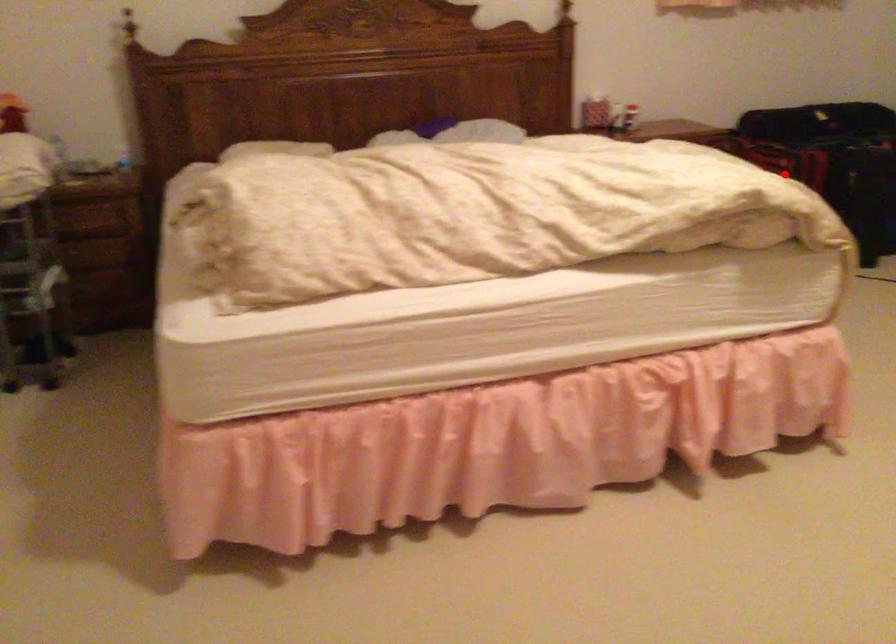
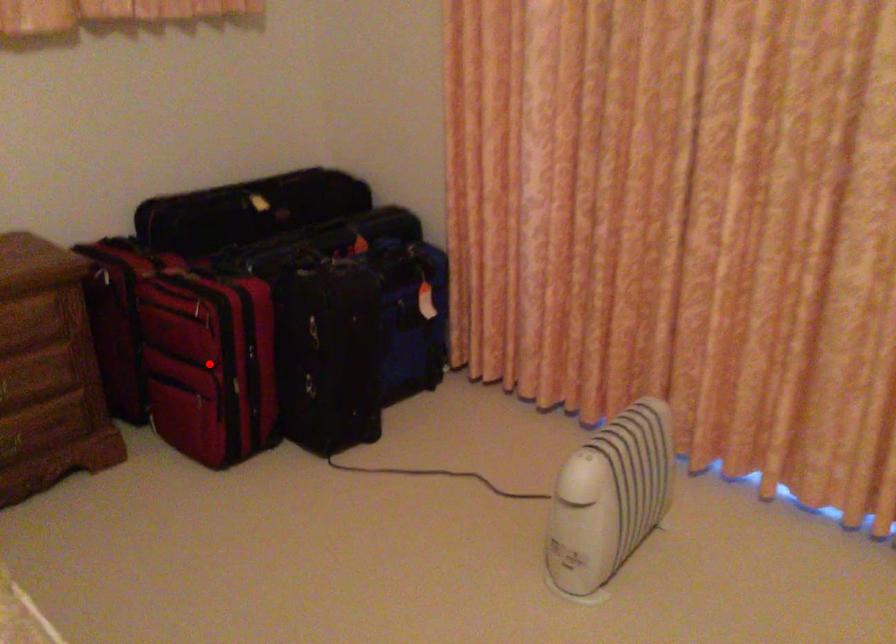
I am providing you with two images of the same scene from different viewpoints. A red point is marked on the first image and another point is marked on the second image. Is the red point in image1 aligned with the point shown in image2?

Yes